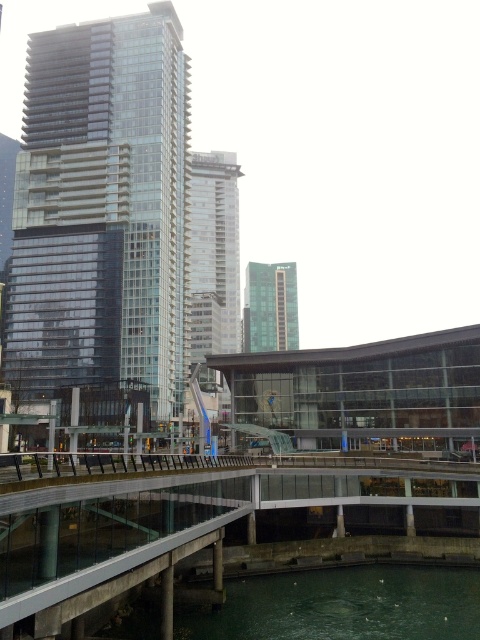
In the scene shown: You are an architect analyzing the urban skyline. Which of the two buildings, the glassy reflective skyscraper at left or the silver glass tower at center, would cast a longer shadow during midday? Explain your reasoning based on their positions and heights.

The glassy reflective skyscraper at left is much taller than the silver glass tower at center, so it would cast a longer shadow during midday because taller objects generally cast longer shadows when the sun is directly overhead.

You are a drone operator tasked with flying a drone from the glassy reflective skyscraper at left to the silver glass tower at center. Based on the scene description, which direction should you fly the drone to reach the destination?

The glassy reflective skyscraper at left is positioned over the silver glass tower at center, so you should fly the drone downward to reach the destination.

You are standing on the curved pedestrian bridge with glass railings and want to take a photo of both the point at coordinates point (83, 268) and the point at coordinates point (444, 486). Which point will appear closer to the camera in the photo?

The point at coordinates point (83, 268) will appear closer to the camera in the photo because it is further to the camera than point (444, 486).